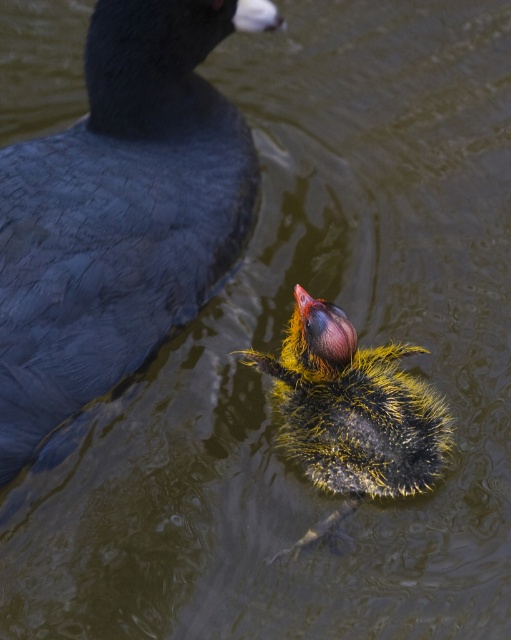
You are a birdwatcher observing the scene. You notice the dark blue feathers at upper left and the yellow downy feather at center. Which of these two features is closer to your viewpoint?

The dark blue feathers at upper left are closer to your viewpoint since they are in front of the yellow downy feather at center.

You are a birdwatcher observing the scene. You notice two distinct features in the image. One is the dark blue feathers at upper left and the other is the yellow downy feather at center. From your vantage point, which of these features is positioned further to the right?

The yellow downy feather at center is positioned further to the right compared to the dark blue feathers at upper left.

You are an ornithologist observing the aquatic scene. You notice two distinct feathers in the water. The first is dark blue feathers at upper left, and the second is yellow downy feather at center. Which of these two feathers has a greater width?

The dark blue feathers at upper left has a greater width than the yellow downy feather at center.